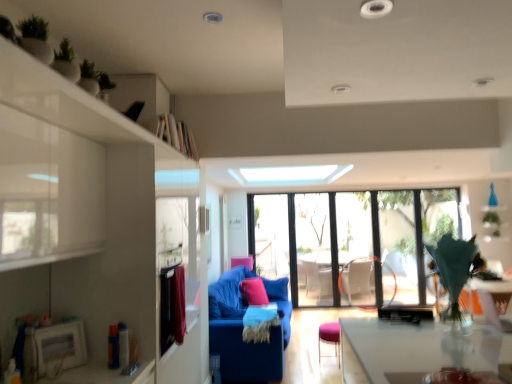
The width and height of the screenshot is (512, 384). Describe the element at coordinates (355, 277) in the screenshot. I see `metallic silver swivel chair at center` at that location.

This screenshot has width=512, height=384. Describe the element at coordinates (494, 300) in the screenshot. I see `white glossy table at lower right` at that location.

You are a GUI agent. You are given a task and a screenshot of the screen. Output one action in this format:
    pyautogui.click(x=<x>, y=<y>)
    Task: Click on the white glossy table at lower right
    This screenshot has height=384, width=512.
    Given the screenshot: What is the action you would take?
    pyautogui.click(x=494, y=300)

From the picture: In order to face pink fabric stool at center, should I rotate leftwards or rightwards?

To align with it, rotate right about 10.711°.

What do you see at coordinates (242, 329) in the screenshot? The height and width of the screenshot is (384, 512). I see `velvet blue couch at center` at bounding box center [242, 329].

This screenshot has width=512, height=384. In order to click on velvet blue couch at center in this screenshot , I will do `click(242, 329)`.

This screenshot has height=384, width=512. Describe the element at coordinates (253, 292) in the screenshot. I see `pink fabric pillow at center` at that location.

Locate an element on the screen. The image size is (512, 384). metallic silver swivel chair at center is located at coordinates (355, 277).

Can you tell me how much velvet blue couch at center and transparent glass window at center differ in facing direction?

They differ by 88.1 degrees in their facing directions.

Which is behind, point (279, 380) or point (344, 287)?

Positioned behind is point (344, 287).

Is velvet blue couch at center turned away from transparent glass window at center?

No, velvet blue couch at center is not facing away from transparent glass window at center.

From the image's perspective, is velvet blue couch at center located above or below transparent glass window at center?

velvet blue couch at center is below transparent glass window at center.

Considering the sizes of objects green matte plant at upper right, the 3th plant when ordered from left to right, and pink fabric armchair at center in the image provided, who is bigger, green matte plant at upper right, the 3th plant when ordered from left to right, or pink fabric armchair at center?

green matte plant at upper right, the 3th plant when ordered from left to right.

Who is more distant, green matte plant at upper right, which is counted as the first plant, starting from the back, or pink fabric armchair at center?

Result: green matte plant at upper right, which is counted as the first plant, starting from the back.

Consider the image. Which is nearer, (494, 211) or (251, 259)?

Point (494, 211) is closer to the camera than point (251, 259).

Can you confirm if green matte plant at upper right, which is counted as the first plant, starting from the back, is thinner than pink fabric armchair at center?

Yes, green matte plant at upper right, which is counted as the first plant, starting from the back, is thinner than pink fabric armchair at center.

Is metallic silver swivel chair at center not close to pink fabric pillow at center?

Yes, metallic silver swivel chair at center and pink fabric pillow at center are quite far apart.

Which is more to the left, metallic silver swivel chair at center or pink fabric pillow at center?

pink fabric pillow at center.

Image resolution: width=512 pixels, height=384 pixels. What are the coordinates of `swivel chair below the pink fabric pillow at center (from the image's perspective)` in the screenshot? It's located at (355, 277).

Does green matte plant at upper right, which is counted as the first plant, starting from the back, appear on the right side of pink fabric pillow at center?

Indeed, green matte plant at upper right, which is counted as the first plant, starting from the back, is positioned on the right side of pink fabric pillow at center.

From a real-world perspective, between green matte plant at upper right, the 3th plant when ordered from left to right, and pink fabric pillow at center, who is vertically lower?

In real-world perspective, pink fabric pillow at center is lower.

Which is in front, point (492, 216) or point (252, 287)?

Positioned in front is point (252, 287).

I want to click on armchair below the white glossy table at lower right (from a real-world perspective), so click(x=243, y=262).

Is pink fabric armchair at center situated inside white glossy table at lower right or outside?

pink fabric armchair at center is spatially situated outside white glossy table at lower right.

Does pink fabric armchair at center have a smaller size compared to white glossy table at lower right?

Incorrect, pink fabric armchair at center is not smaller in size than white glossy table at lower right.

Could you tell me if pink fabric armchair at center is facing white glossy table at lower right?

No, pink fabric armchair at center is not turned towards white glossy table at lower right.

Is green leafy plant in vase at right, the 2th plant viewed from the back, located outside velvet blue couch at center?

Yes, green leafy plant in vase at right, the 2th plant viewed from the back, is outside of velvet blue couch at center.

From a real-world perspective, is green leafy plant in vase at right, which is the 2th plant from left to right, positioned under velvet blue couch at center based on gravity?

No, from a real-world perspective, green leafy plant in vase at right, which is the 2th plant from left to right, is not under velvet blue couch at center.

Between green leafy plant in vase at right, which is the first plant from bottom to top, and velvet blue couch at center, which one has larger width?

With larger width is velvet blue couch at center.

Looking at this image, does green leafy plant in vase at right, the third plant from the top, appear on the left side of velvet blue couch at center?

No, green leafy plant in vase at right, the third plant from the top, is not to the left of velvet blue couch at center.

Can you tell me how much pink fabric stool at center and velvet blue couch at center differ in facing direction?

pink fabric stool at center and velvet blue couch at center are facing 5.57 degrees away from each other.

Find the location of a particular element. stool below the velvet blue couch at center (from a real-world perspective) is located at coordinates (330, 337).

Are pink fabric stool at center and velvet blue couch at center making contact?

pink fabric stool at center is not next to velvet blue couch at center, and they're not touching.

Could you tell me if pink fabric stool at center is turned towards velvet blue couch at center?

No, pink fabric stool at center is not turned towards velvet blue couch at center.

What are the coordinates of `window that is on the right side of velvet blue couch at center` in the screenshot? It's located at (352, 242).

At what (x,y) coordinates should I click in order to perform the action: click on armchair that is on the left side of green matte plant at upper right, which is the first plant in right-to-left order. Please return your answer as a coordinate pair (x, y). This screenshot has height=384, width=512. Looking at the image, I should click on (243, 262).

Estimate the real-world distances between objects in this image. Which object is closer to transparent glass window at center, velvet blue couch at center or green matte plant at upper right, which is counted as the first plant, starting from the back?

velvet blue couch at center.

When comparing their distances from metallic silver swivel chair at center, does white glossy table at lower right or pink fabric armchair at center seem further?

Based on the image, white glossy table at lower right appears to be further to metallic silver swivel chair at center.

Which object lies further to the anchor point pink fabric stool at center, transparent glass window at center or velvet blue couch at center?

Among the two, transparent glass window at center is located further to pink fabric stool at center.

Looking at the image, which one is located closer to green matte plant at upper right, the 2th plant in the bottom-to-top sequence, transparent glass window at center or pink fabric pillow at center?

transparent glass window at center is closer to green matte plant at upper right, the 2th plant in the bottom-to-top sequence.

Considering their positions, is metallic silver swivel chair at center positioned closer to white glossy table at lower right than green matte plant at upper right, which is the third plant from front to back?

green matte plant at upper right, which is the third plant from front to back, lies closer to white glossy table at lower right than the other object.

From the image, which object appears to be nearer to pink fabric armchair at center, velvet blue couch at center or metallic silver swivel chair at center?

velvet blue couch at center is positioned closer to the anchor pink fabric armchair at center.

From the image, which object appears to be nearer to white glossy table at lower right, green leafy plant in vase at right, which is the first plant from bottom to top, or pink fabric armchair at center?

green leafy plant in vase at right, which is the first plant from bottom to top.

From the image, which object appears to be farther from velvet blue couch at center, pink fabric armchair at center or pink fabric pillow at center?

pink fabric armchair at center.

This screenshot has width=512, height=384. I want to click on table between green matte plant at upper left, placed as the third plant when sorted from back to front, and transparent glass window at center in the front-back direction, so click(x=494, y=300).

Identify the location of table located between green matte plant at upper left, which is the 1th plant in front-to-back order, and metallic silver swivel chair at center in the depth direction. (494, 300).

The image size is (512, 384). I want to click on stool positioned between velvet blue couch at center and transparent glass window at center from near to far, so click(330, 337).

At what (x,y) coordinates should I click in order to perform the action: click on armchair positioned between green leafy plant in vase at right, which is the first plant from bottom to top, and metallic silver swivel chair at center from near to far. Please return your answer as a coordinate pair (x, y). The width and height of the screenshot is (512, 384). Looking at the image, I should click on (243, 262).